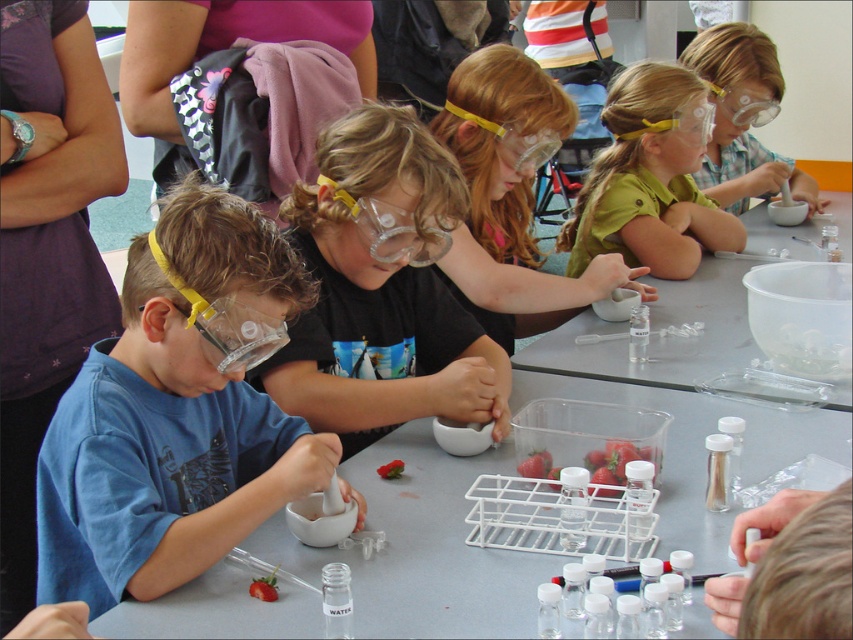
You are a teacher observing the science activity. Where is the green matte shirt at upper center located in the image?

The green matte shirt at upper center is located at point 0.281 on the horizontal axis and 0.763 on the vertical axis.

You are a teacher organizing a science experiment. You have a clear plastic mortar at center and a clear plastic bowl at center on the table. Which container can hold more liquid for the experiment?

The clear plastic bowl at center can hold more liquid because it occupies more space than the clear plastic mortar at center.

Consider the image. You are a student in the classroom and need to place a 12 inch ruler between the clear plastic mortar at center and the clear plastic bowl at center. Will the ruler fit between them?

The clear plastic mortar at center is 20.27 inches from clear plastic bowl at center, so yes, the ruler will fit between them since it is shorter than the distance between the two objects.